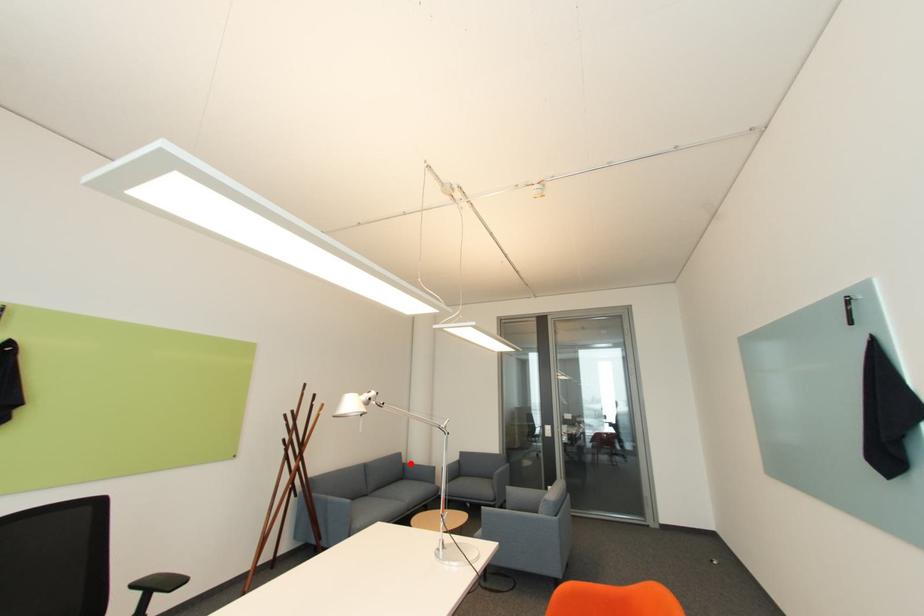
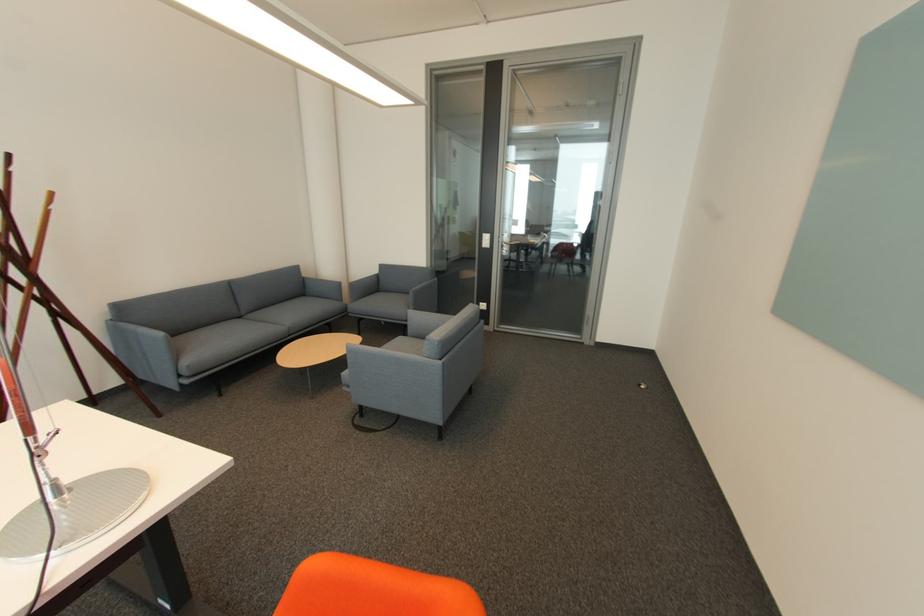
Question: A red point is marked in image1. In image2, is the corresponding 3D point closer to the camera or farther? Reply with the corresponding letter.

Choices:
 (A) The corresponding 3D point is closer.
 (B) The corresponding 3D point is farther.

Answer: (A)